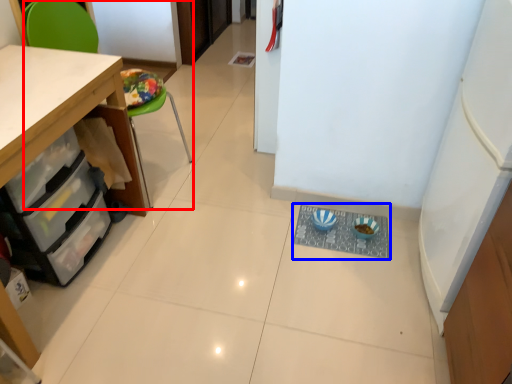
Question: Which point is further to the camera, chair (highlighted by a red box) or wide (highlighted by a blue box)?

Choices:
 (A) chair
 (B) wide

Answer: (B)